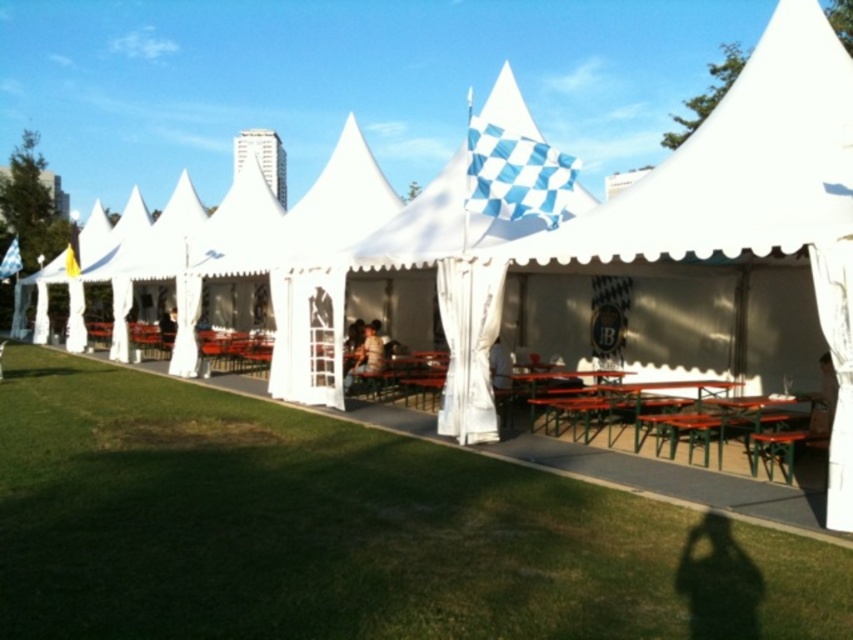
You are planning to set up a small buffet for an event. You have a 24 inch wide buffet tray that needs to be placed between the wooden picnic table at center and the green metal table at center. Can the buffet tray fit between them?

The wooden picnic table at center and green metal table at center are 22.84 inches apart. Since the buffet tray is 24 inches wide, it cannot fit between them as the space is narrower than the tray.

You are standing in front of the tents and want to sit at the closest table. Which table should you choose between the wooden picnic table at center and the green metal table at center?

The wooden picnic table at center is closer to the viewer, so you should choose the wooden picnic table at center.

You are a guest at an outdoor event and want to find a place to sit. You see the green grass at lower left and the green metal table at center. Which surface is lower to the ground?

The green grass at lower left has a lesser height compared to the green metal table at center, so the green grass at lower left is lower to the ground.